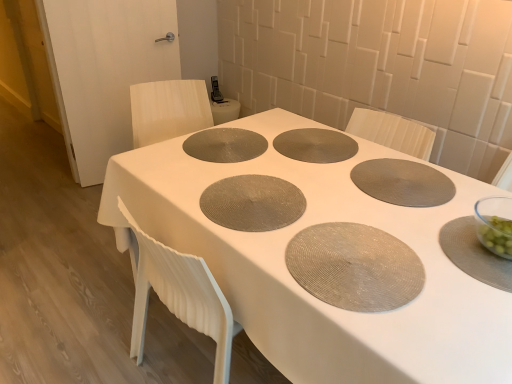
The width and height of the screenshot is (512, 384). I want to click on free point below matte gray placemat at center, which appears as the first oval when viewed from the right (from a real-world perspective), so click(x=351, y=253).